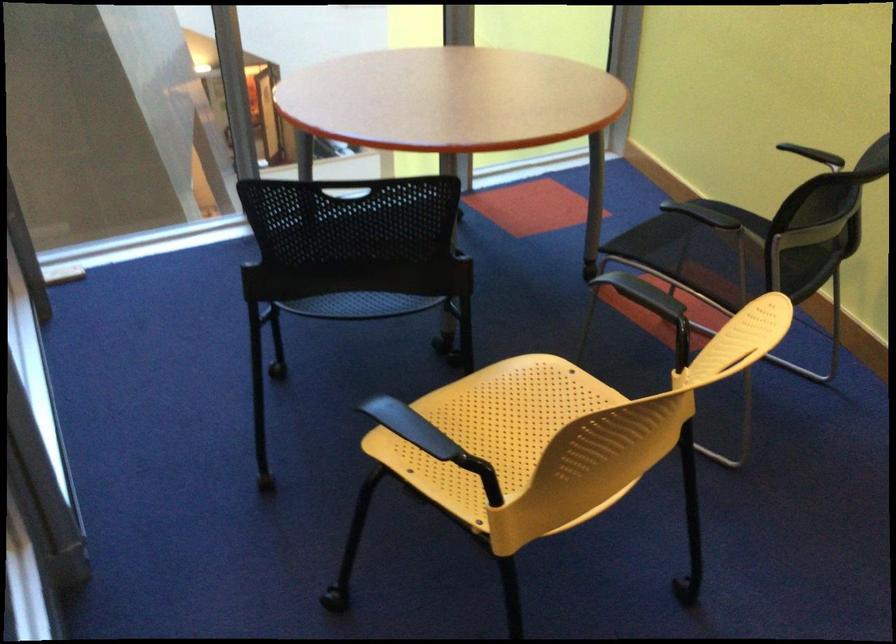
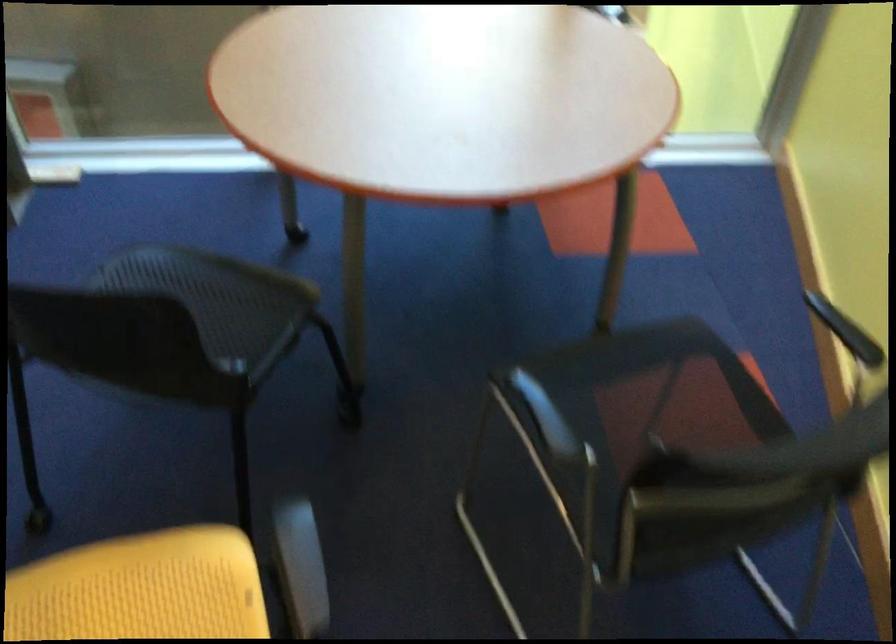
The images are taken continuously from a first-person perspective. In which direction are you moving?

The movement direction of the cameraman is right, forward.